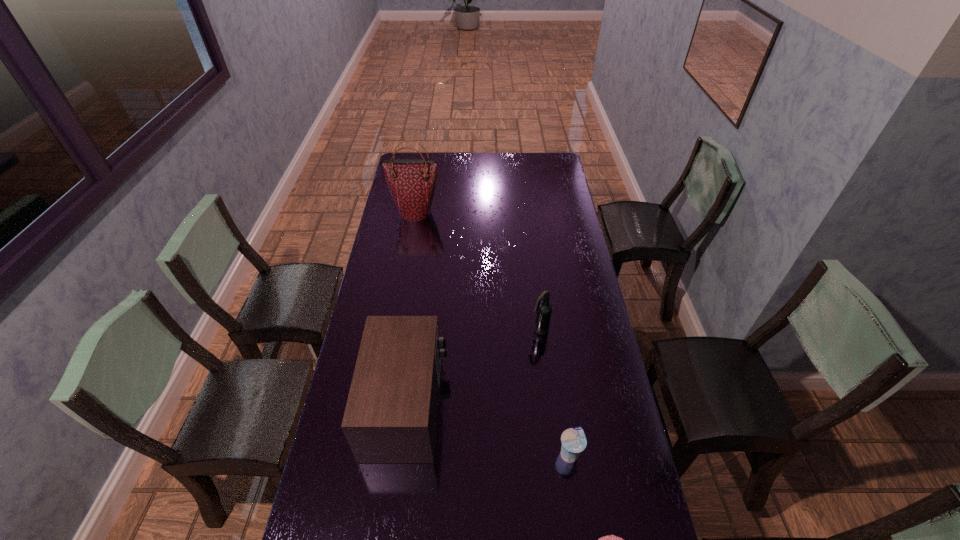
The height and width of the screenshot is (540, 960). I want to click on the tallest object, so click(411, 182).

At what (x,y) coordinates should I click in order to perform the action: click on handbag. Please return your answer as a coordinate pair (x, y). Looking at the image, I should click on (411, 182).

Locate an element on the screen. Image resolution: width=960 pixels, height=540 pixels. radio receiver is located at coordinates (391, 413).

Find the location of a particular element. the fourth nearest object is located at coordinates (544, 309).

Find the location of a particular element. This screenshot has height=540, width=960. yogurt is located at coordinates (573, 440).

Identify the location of vacant space situated on the back of the farthest object. Image resolution: width=960 pixels, height=540 pixels. (422, 173).

The image size is (960, 540). I want to click on free space located 0.200m on the front-facing side of the radio receiver, so click(511, 406).

Where is `vacant region located on the back of the beer bottle`? This screenshot has height=540, width=960. vacant region located on the back of the beer bottle is located at coordinates (533, 278).

What are the coordinates of `free space located 0.200m on the left of the fourth tallest object` in the screenshot? It's located at (488, 454).

Identify the location of handbag positioned at the left edge. (411, 182).